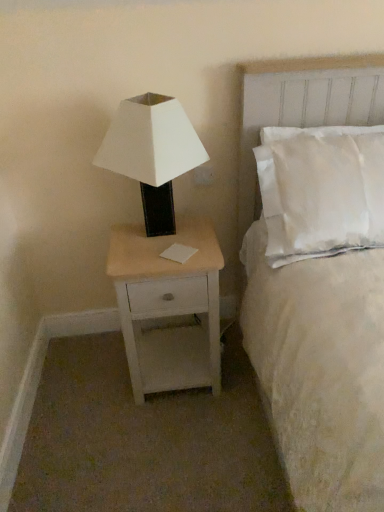
Question: Can you confirm if white matte/black base lamp at left is thinner than light wood/white painted nightstand at lower left?

Choices:
 (A) no
 (B) yes

Answer: (B)

Question: Considering the relative positions of white matte/black base lamp at left and light wood/white painted nightstand at lower left in the image provided, is white matte/black base lamp at left in front of light wood/white painted nightstand at lower left?

Choices:
 (A) yes
 (B) no

Answer: (A)

Question: Is white matte/black base lamp at left not close to light wood/white painted nightstand at lower left?

Choices:
 (A) no
 (B) yes

Answer: (A)

Question: Could you tell me if white matte/black base lamp at left is turned towards light wood/white painted nightstand at lower left?

Choices:
 (A) no
 (B) yes

Answer: (A)

Question: From the image's perspective, is white matte/black base lamp at left beneath light wood/white painted nightstand at lower left?

Choices:
 (A) no
 (B) yes

Answer: (A)

Question: Considering the relative positions of white plastic electric outlet at upper right and white matte/black base lamp at left in the image provided, is white plastic electric outlet at upper right to the left or to the right of white matte/black base lamp at left?

Choices:
 (A) right
 (B) left

Answer: (A)

Question: Considering their positions, is white plastic electric outlet at upper right located in front of or behind white matte/black base lamp at left?

Choices:
 (A) behind
 (B) front

Answer: (A)

Question: Is white plastic electric outlet at upper right inside or outside of white matte/black base lamp at left?

Choices:
 (A) outside
 (B) inside

Answer: (A)

Question: From the image's perspective, is white plastic electric outlet at upper right above or below white matte/black base lamp at left?

Choices:
 (A) below
 (B) above

Answer: (B)

Question: In the image, is white matte/black base lamp at left positioned in front of or behind white plastic electric outlet at upper right?

Choices:
 (A) front
 (B) behind

Answer: (A)

Question: Does point (172, 117) appear closer or farther from the camera than point (196, 181)?

Choices:
 (A) closer
 (B) farther

Answer: (A)

Question: Based on their positions, is white matte/black base lamp at left located to the left or right of white plastic electric outlet at upper right?

Choices:
 (A) right
 (B) left

Answer: (B)

Question: From the image's perspective, relative to white plastic electric outlet at upper right, is white matte/black base lamp at left above or below?

Choices:
 (A) below
 (B) above

Answer: (A)

Question: Would you say white soft bed at upper right is to the left or to the right of white matte/black base lamp at left in the picture?

Choices:
 (A) right
 (B) left

Answer: (A)

Question: Looking at their shapes, would you say white soft bed at upper right is wider or thinner than white matte/black base lamp at left?

Choices:
 (A) wide
 (B) thin

Answer: (A)